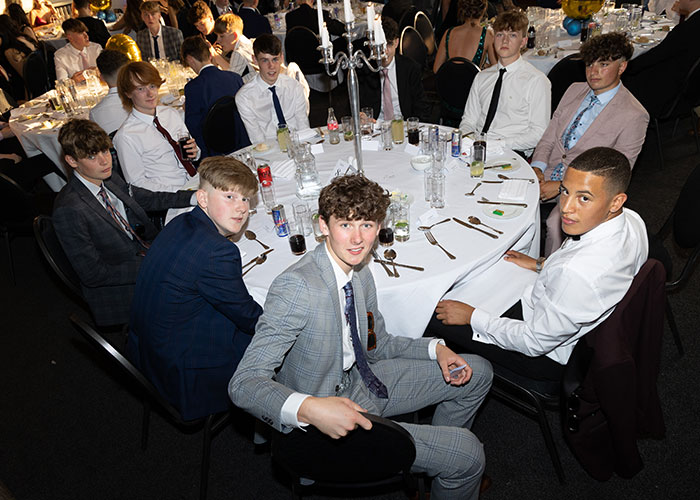
Find the location of a particular element. This screenshot has height=500, width=700. candles is located at coordinates (323, 40), (321, 13), (346, 14), (370, 11), (382, 36).